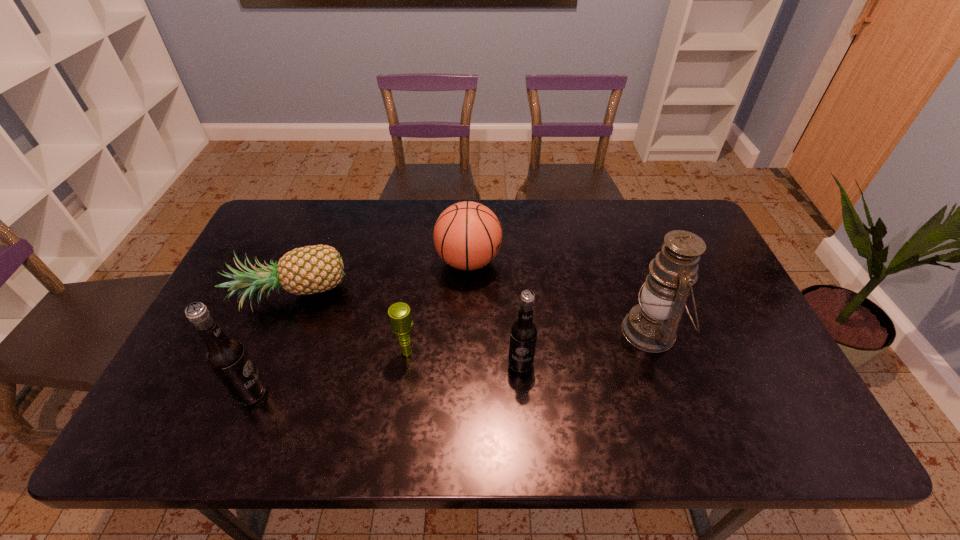
Image resolution: width=960 pixels, height=540 pixels. In order to click on blank space at the left edge in this screenshot , I will do `click(267, 295)`.

In the image, there is a desktop. Find the location of `free space at the right edge`. free space at the right edge is located at coordinates (757, 363).

I want to click on free space at the far left corner of the desktop, so click(275, 244).

Image resolution: width=960 pixels, height=540 pixels. Find the location of `free space at the far right corner of the desktop`. free space at the far right corner of the desktop is located at coordinates (661, 225).

In order to click on vacant region between the rightmost object and the fourth tallest object in this screenshot , I will do `click(560, 296)`.

Identify the location of free space between the shorter root beer and the microphone. The image size is (960, 540). (464, 357).

At what (x,y) coordinates should I click in order to perform the action: click on free space between the rightmost object and the fourth shortest object. Please return your answer as a coordinate pair (x, y). Looking at the image, I should click on point(586,347).

Image resolution: width=960 pixels, height=540 pixels. I want to click on vacant space that is in between the rightmost object and the pineapple, so 471,315.

Find the location of a particular element. The height and width of the screenshot is (540, 960). free space between the pineapple and the left root beer is located at coordinates (271, 345).

Identify the location of vacant space that's between the oil lamp and the third object from right to left. (560, 296).